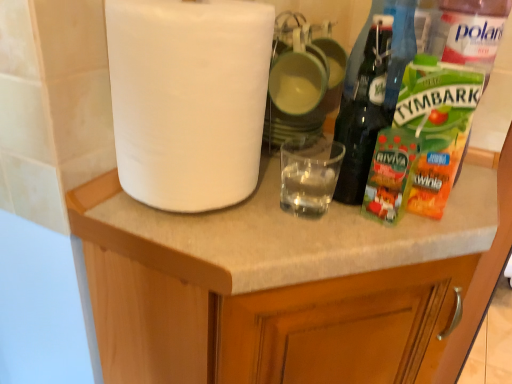
Where is `free point in front of white matte paper towel at upper left`? The image size is (512, 384). free point in front of white matte paper towel at upper left is located at coordinates (205, 236).